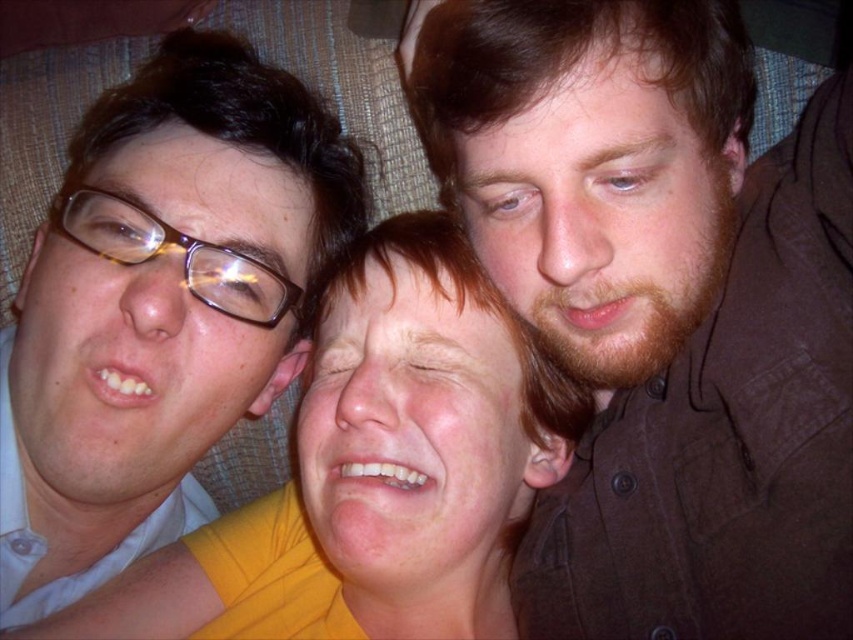
Question: Can you confirm if brown matte shirt at upper right is positioned to the right of yellow matte shirt at center?

Choices:
 (A) no
 (B) yes

Answer: (B)

Question: Is brown matte shirt at upper right closer to camera compared to matte black glasses at left?

Choices:
 (A) no
 (B) yes

Answer: (B)

Question: Which point is closer to the camera taking this photo?

Choices:
 (A) (598, 196)
 (B) (294, 128)
 (C) (343, 376)

Answer: (A)

Question: Among these objects, which one is farthest from the camera?

Choices:
 (A) matte black glasses at left
 (B) brown matte shirt at upper right
 (C) yellow matte shirt at center

Answer: (A)

Question: From the image, what is the correct spatial relationship of brown matte shirt at upper right in relation to yellow matte shirt at center?

Choices:
 (A) above
 (B) below

Answer: (A)

Question: Which object is the farthest from the brown matte shirt at upper right?

Choices:
 (A) yellow matte shirt at center
 (B) matte black glasses at left

Answer: (B)